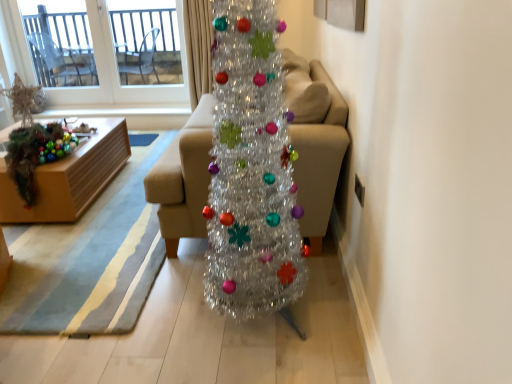
What is the approximate height of beige fabric couch at center?

beige fabric couch at center is 31.99 inches tall.

Describe the element at coordinates (146, 41) in the screenshot. I see `transparent glass door at upper left` at that location.

Measure the distance between point (190, 22) and camera.

They are 3.65 meters apart.

This screenshot has width=512, height=384. I want to click on shiny metallic christmas tree at center, so click(x=251, y=169).

Would you say wooden box at left is part of beige fabric couch at center's contents?

No, wooden box at left is located outside of beige fabric couch at center.

Considering the relative sizes of beige fabric couch at center and wooden box at left in the image provided, is beige fabric couch at center smaller than wooden box at left?

No, beige fabric couch at center is not smaller than wooden box at left.

Can you tell me how much beige fabric couch at center and wooden box at left differ in facing direction?

179 degrees.

Is beige fabric couch at center in front of or behind wooden box at left in the image?

Visually, beige fabric couch at center is located in front of wooden box at left.

Between transparent glass window at upper left and wooden box at left, which one appears on the right side from the viewer's perspective?

wooden box at left is more to the right.

Looking at this image, which object is closer to the camera, transparent glass window at upper left or wooden box at left?

wooden box at left is closer to the camera.

Is transparent glass window at upper left aimed at wooden box at left?

Yes, transparent glass window at upper left is aimed at wooden box at left.

Is transparent glass window at upper left not near wooden box at left?

Absolutely, transparent glass window at upper left is distant from wooden box at left.

Can you tell me how much beige fabric couch at center and transparent glass window at upper left differ in facing direction?

They differ by 89.2 degrees in their facing directions.

Identify the location of window on the left side of beige fabric couch at center. The height and width of the screenshot is (384, 512). (117, 72).

Between beige fabric couch at center and transparent glass window at upper left, which one appears on the right side from the viewer's perspective?

beige fabric couch at center.

In terms of size, does beige fabric couch at center appear bigger or smaller than transparent glass window at upper left?

Clearly, beige fabric couch at center is larger in size than transparent glass window at upper left.

Is transparent glass door at upper left shorter than wooden box at left?

In fact, transparent glass door at upper left may be taller than wooden box at left.

From a real-world perspective, does transparent glass door at upper left sit lower than wooden box at left?

Actually, transparent glass door at upper left is physically above wooden box at left in the real world.

Is transparent glass door at upper left not close to wooden box at left?

transparent glass door at upper left is far away from wooden box at left.

How different are the orientations of transparent glass door at upper left and wooden box at left in degrees?

The facing directions of transparent glass door at upper left and wooden box at left are 91.7 degrees apart.

Is wooden box at left completely or partially outside of shiny metallic christmas tree at center?

That's correct, wooden box at left is outside of shiny metallic christmas tree at center.

Considering the sizes of wooden box at left and shiny metallic christmas tree at center in the image, is wooden box at left bigger or smaller than shiny metallic christmas tree at center?

Considering their sizes, wooden box at left takes up more space than shiny metallic christmas tree at center.

Does wooden box at left have a greater width compared to shiny metallic christmas tree at center?

Correct, the width of wooden box at left exceeds that of shiny metallic christmas tree at center.

Considering the relative positions of transparent glass door at upper left and shiny metallic christmas tree at center in the image provided, is transparent glass door at upper left to the right of shiny metallic christmas tree at center from the viewer's perspective?

No, transparent glass door at upper left is not to the right of shiny metallic christmas tree at center.

Is transparent glass door at upper left far from shiny metallic christmas tree at center?

Yes, transparent glass door at upper left and shiny metallic christmas tree at center are located far from each other.

Is transparent glass door at upper left oriented away from shiny metallic christmas tree at center?

No, transparent glass door at upper left's orientation is not away from shiny metallic christmas tree at center.

Based on the photo, from their relative heights in the image, would you say transparent glass door at upper left is taller or shorter than shiny metallic christmas tree at center?

In the image, transparent glass door at upper left appears to be shorter than shiny metallic christmas tree at center.

Could transparent glass door at upper left be considered to be inside wooden box at left?

No, wooden box at left does not contain transparent glass door at upper left.

Based on the photo, is wooden box at left bigger than transparent glass door at upper left?

Yes, wooden box at left is bigger than transparent glass door at upper left.

Consider the image. From the image's perspective, between wooden box at left and transparent glass door at upper left, who is located below?

wooden box at left.

Which object is further away from the camera, wooden box at left or transparent glass door at upper left?

transparent glass door at upper left is behind.

At what (x,y) coordinates should I click in order to perform the action: click on studio couch on the right of wooden box at left. Please return your answer as a coordinate pair (x, y). Looking at the image, I should click on (315, 141).

The width and height of the screenshot is (512, 384). In order to click on furniture below the transparent glass window at upper left (from the image's perspective) in this screenshot , I will do `click(69, 177)`.

Looking at the image, which one is located closer to beige fabric couch at center, wooden box at left or transparent glass window at upper left?

The object closer to beige fabric couch at center is wooden box at left.

Which object lies further to the anchor point shiny metallic christmas tree at center, wooden box at left or shiny beige curtain at upper center?

shiny beige curtain at upper center.

Estimate the real-world distances between objects in this image. Which object is closer to shiny metallic christmas tree at center, transparent glass window at upper left or beige fabric couch at center?

beige fabric couch at center is closer to shiny metallic christmas tree at center.

Which object lies nearer to the anchor point beige fabric couch at center, wooden box at left or transparent glass door at upper left?

wooden box at left is closer to beige fabric couch at center.

Looking at the image, which one is located closer to transparent glass door at upper left, wooden box at left or shiny beige curtain at upper center?

Among the two, shiny beige curtain at upper center is located nearer to transparent glass door at upper left.

Considering their positions, is shiny beige curtain at upper center positioned closer to shiny metallic christmas tree at center than transparent glass window at upper left?

shiny beige curtain at upper center lies closer to shiny metallic christmas tree at center than the other object.

Which object lies nearer to the anchor point beige fabric couch at center, transparent glass window at upper left or transparent glass door at upper left?

The object closer to beige fabric couch at center is transparent glass window at upper left.

Which object lies further to the anchor point wooden box at left, transparent glass door at upper left or transparent glass window at upper left?

Based on the image, transparent glass door at upper left appears to be further to wooden box at left.

This screenshot has width=512, height=384. Identify the location of screen door between beige fabric couch at center and transparent glass window at upper left from front to back. (146, 41).

Identify the location of screen door between transparent glass window at upper left and shiny beige curtain at upper center in the horizontal direction. (146, 41).

At what (x,y) coordinates should I click in order to perform the action: click on studio couch between shiny metallic christmas tree at center and transparent glass window at upper left from front to back. Please return your answer as a coordinate pair (x, y). The height and width of the screenshot is (384, 512). Looking at the image, I should click on (315, 141).

Find the location of a particular element. The height and width of the screenshot is (384, 512). furniture located between beige fabric couch at center and transparent glass door at upper left in the depth direction is located at coordinates (69, 177).